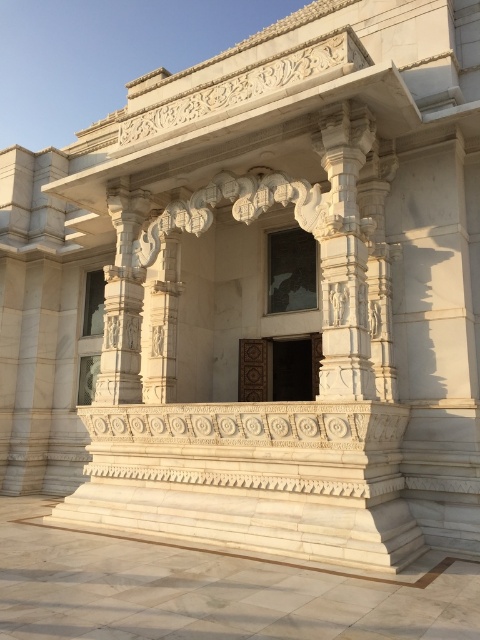
Question: Which of the following is the closest to the observer?

Choices:
 (A) (355, 144)
 (B) (120, 269)

Answer: (A)

Question: Which object appears farthest from the camera in this image?

Choices:
 (A) white carved pillar at center
 (B) white stone column at center

Answer: (A)

Question: Considering the relative positions of white stone column at center and white carved pillar at center in the image provided, where is white stone column at center located with respect to white carved pillar at center?

Choices:
 (A) right
 (B) left

Answer: (A)

Question: Among these points, which one is nearest to the camera?

Choices:
 (A) (132, 337)
 (B) (331, 115)

Answer: (B)

Question: Is white stone column at center positioned in front of white carved pillar at center?

Choices:
 (A) no
 (B) yes

Answer: (B)

Question: Does white stone column at center lie in front of white carved pillar at center?

Choices:
 (A) no
 (B) yes

Answer: (B)